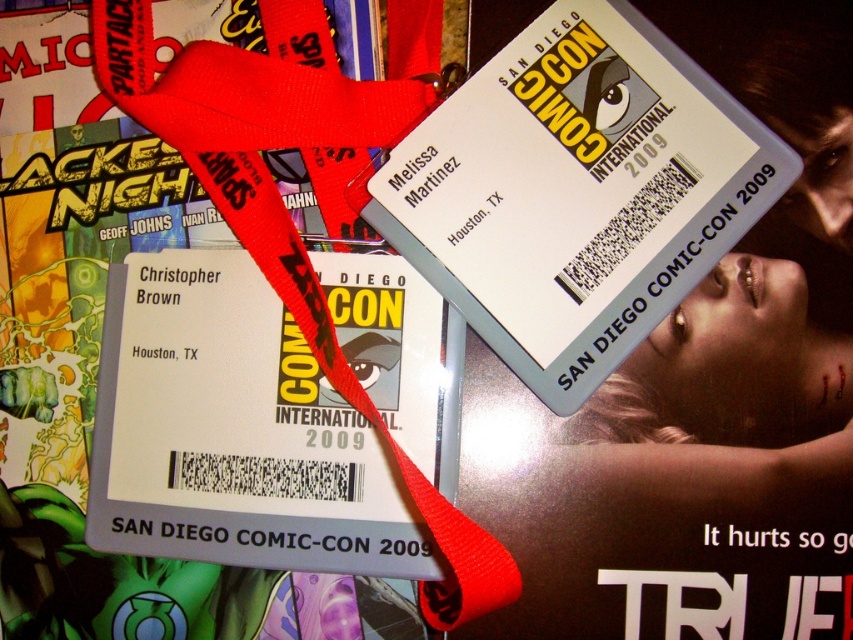
Question: Which point is farther from the camera taking this photo?

Choices:
 (A) (619, 35)
 (B) (241, 336)

Answer: (A)

Question: Can you confirm if white plastic badge at center is bigger than white cardstock ticket at center?

Choices:
 (A) yes
 (B) no

Answer: (A)

Question: Is white plastic badge at center below white cardstock ticket at center?

Choices:
 (A) yes
 (B) no

Answer: (B)

Question: Can you confirm if white plastic badge at center is thinner than white cardstock ticket at center?

Choices:
 (A) no
 (B) yes

Answer: (A)